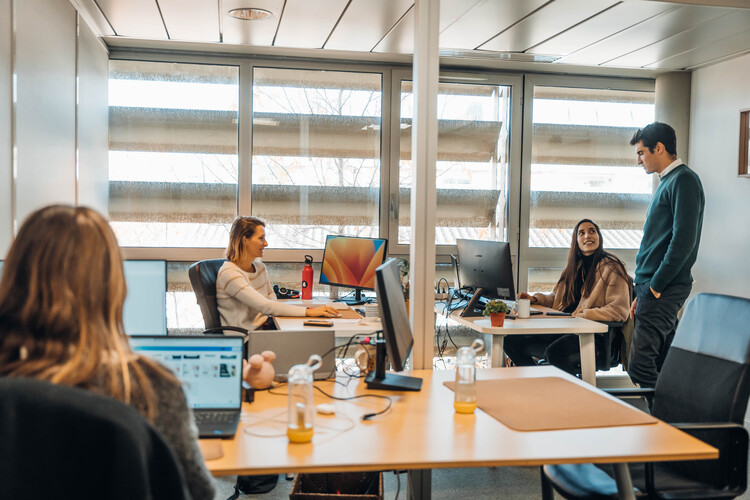
The width and height of the screenshot is (750, 500). In order to click on glass windows in this screenshot , I will do `click(178, 157)`, `click(297, 143)`, `click(462, 136)`, `click(627, 149)`.